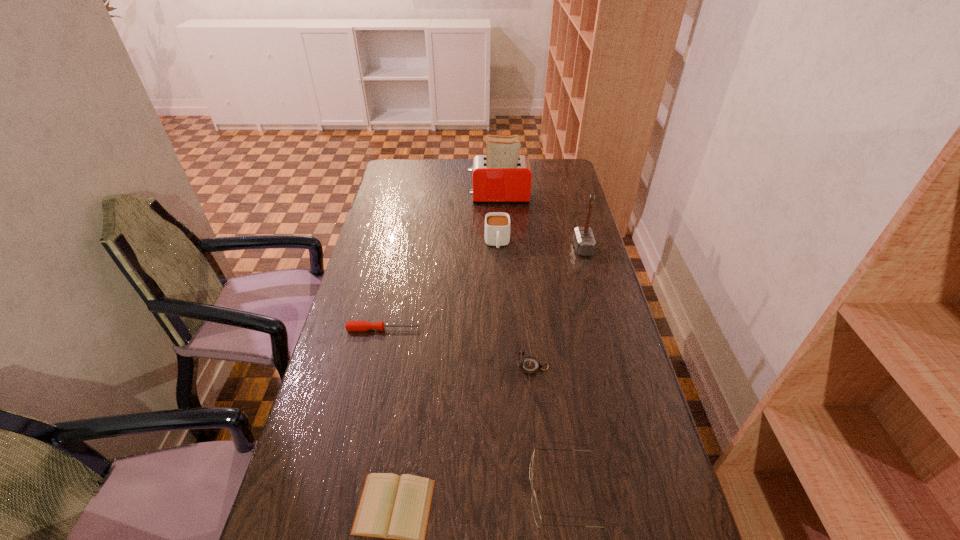
Find the location of a particular element. This screenshot has height=540, width=960. vacant space located 0.360m on the front-facing side of the farthest object is located at coordinates (385, 197).

This screenshot has height=540, width=960. Identify the location of vacant space situated 0.050m on the front-facing side of the farthest object. (457, 197).

This screenshot has width=960, height=540. Find the location of `vacant space situated 0.090m on the striking surface of the hammer`. vacant space situated 0.090m on the striking surface of the hammer is located at coordinates (550, 248).

Find the location of a particular element. The height and width of the screenshot is (540, 960). vacant position located on the striking surface of the hammer is located at coordinates (486, 248).

At what (x,y) coordinates should I click in order to perform the action: click on free space located on the striking surface of the hammer. Please return your answer as a coordinate pair (x, y). The image size is (960, 540). Looking at the image, I should click on (502, 248).

Image resolution: width=960 pixels, height=540 pixels. In order to click on blank space located on the side with the handle of the cup in this screenshot , I will do `click(498, 274)`.

Locate an element on the screen. free location located on the face of the fifth farthest object is located at coordinates (450, 367).

The image size is (960, 540). Identify the location of free spot located 0.330m on the face of the fifth farthest object. (400, 367).

You are a GUI agent. You are given a task and a screenshot of the screen. Output one action in this format:
    pyautogui.click(x=<x>, y=<y>)
    Task: Click on the vacant area situated on the face of the fifth farthest object
    
    Given the screenshot: What is the action you would take?
    pyautogui.click(x=492, y=367)

At what (x,y) coordinates should I click in order to perform the action: click on free point located on the front-facing side of the fifth tallest object. Please return your answer as a coordinate pair (x, y). The image size is (960, 540). Looking at the image, I should click on (494, 491).